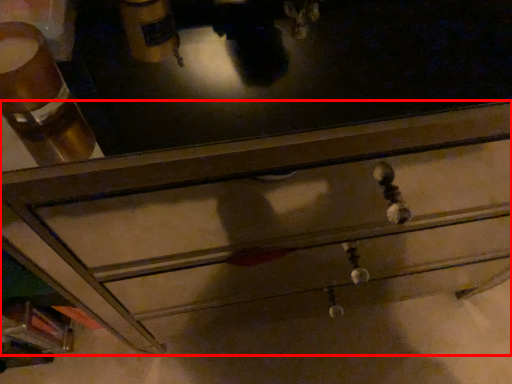
Question: From the image's perspective, what is the correct spatial positioning of chest of drawers (annotated by the red box) in reference to beverage?

Choices:
 (A) below
 (B) above

Answer: (A)